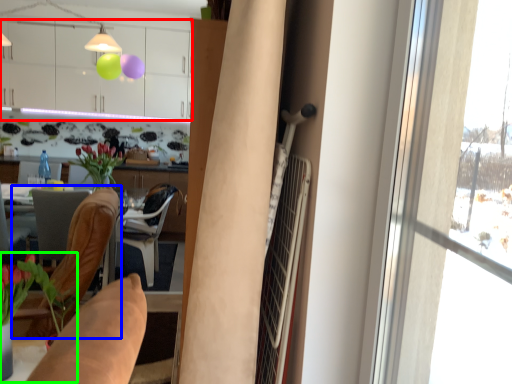
Question: Which object is positioned closest to cabinetry (highlighted by a red box)? Select from chair (highlighted by a blue box) and houseplant (highlighted by a green box).

Choices:
 (A) chair
 (B) houseplant

Answer: (A)